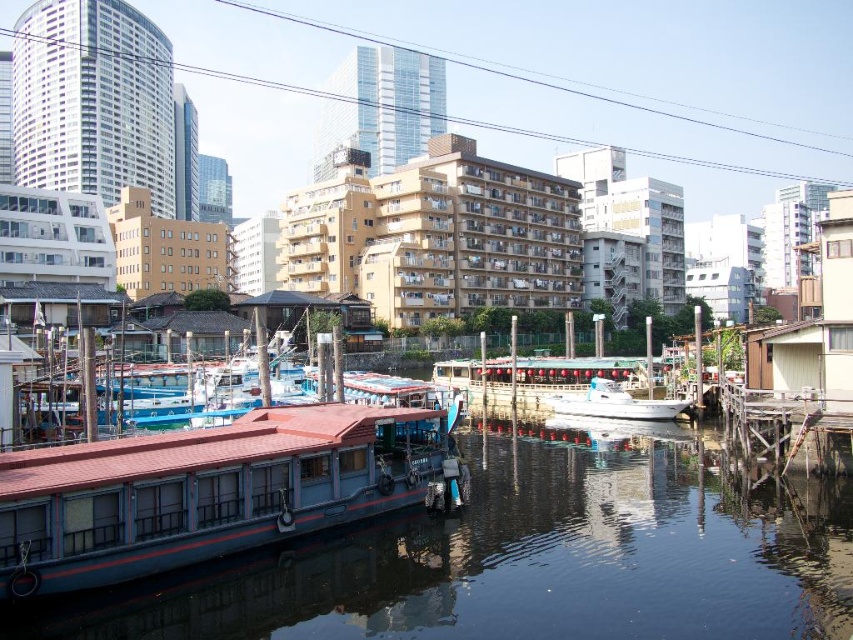
You are navigating a small drone that needs to fly from the blue painted wood boat at lower left to a point directly above the center of the image. Given the boat is at coordinates 0.767 on the x and 0.250 on the y axis, will the drone have to move upwards or downwards to reach the center?

The blue painted wood boat at lower left is located at point (212, 490). The center of the image would be at coordinates (426, 320). Since the boat is at y 0.250, which is below the center y of 0.5, the drone must move upwards to reach the center.

You are a photographer planning to take a photo of the blue painted wood boat at lower left and the white glossy boat at center. Since you want to ensure both boats are fully visible in the frame, which boat requires you to adjust your camera angle upwards more?

The blue painted wood boat at lower left requires adjusting the camera angle upwards more because it has a greater height compared to the white glossy boat at center.